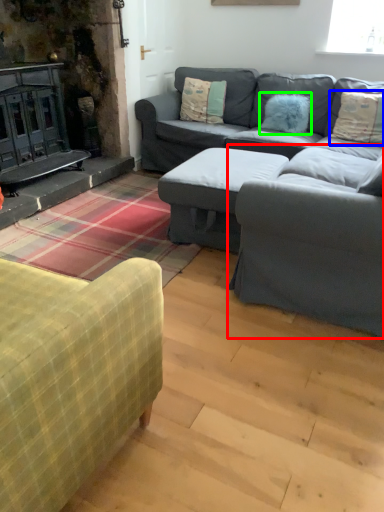
Question: Estimate the real-world distances between objects in this image. Which object is closer to armchair (highlighted by a red box), pillow (highlighted by a blue box) or pillow (highlighted by a green box)?

Choices:
 (A) pillow
 (B) pillow

Answer: (A)